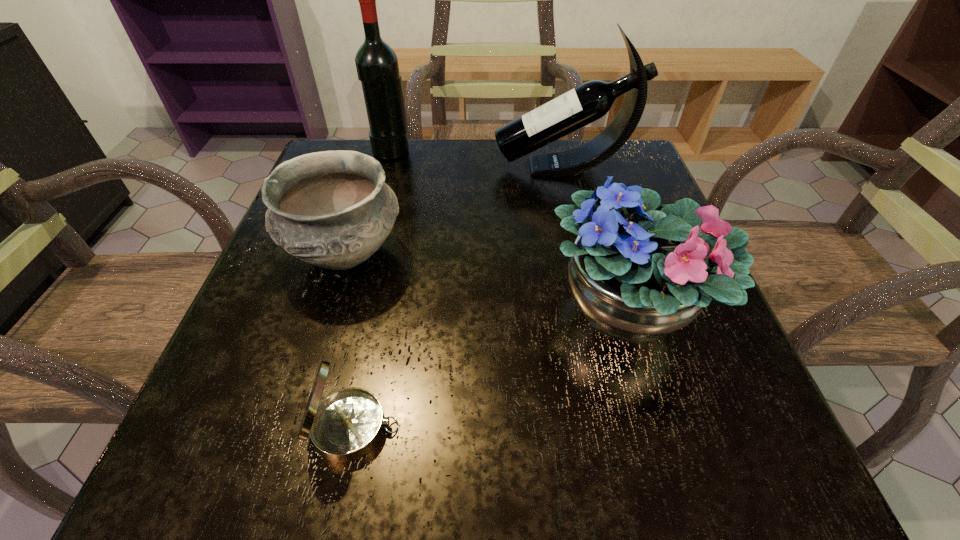
Find the location of a particular element. The height and width of the screenshot is (540, 960). the left wine bottle is located at coordinates (377, 67).

At what (x,y) coordinates should I click in order to perform the action: click on the second tallest object. Please return your answer as a coordinate pair (x, y). The height and width of the screenshot is (540, 960). Looking at the image, I should click on (590, 101).

Find the location of a particular element. The image size is (960, 540). the shorter wine bottle is located at coordinates (590, 101).

Find the location of a particular element. the third shortest object is located at coordinates (639, 271).

Where is `pottery`? Image resolution: width=960 pixels, height=540 pixels. pottery is located at coordinates (332, 209).

Locate an element on the screen. compass is located at coordinates (345, 426).

Locate an element on the screen. This screenshot has width=960, height=540. the shortest object is located at coordinates (345, 426).

Find the location of a particular element. This screenshot has height=540, width=960. vacant space located 0.310m on the right of the left wine bottle is located at coordinates (539, 150).

Locate an element on the screen. The image size is (960, 540). free space located on the stand of the right wine bottle is located at coordinates pyautogui.click(x=459, y=167).

I want to click on free space located on the stand of the right wine bottle, so click(397, 167).